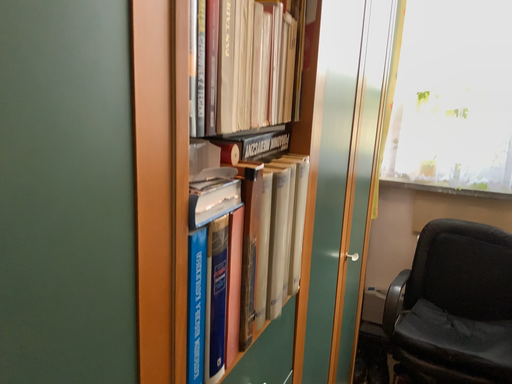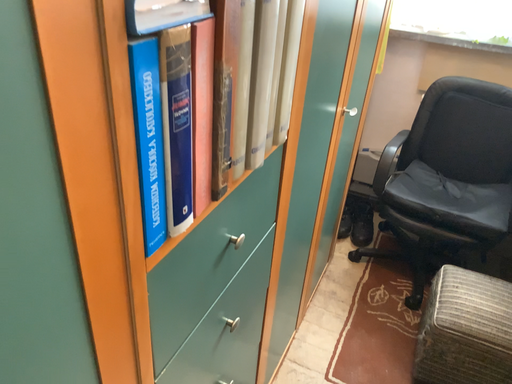
Question: Which way did the camera rotate in the video?

Choices:
 (A) rotated downward
 (B) rotated upward

Answer: (A)